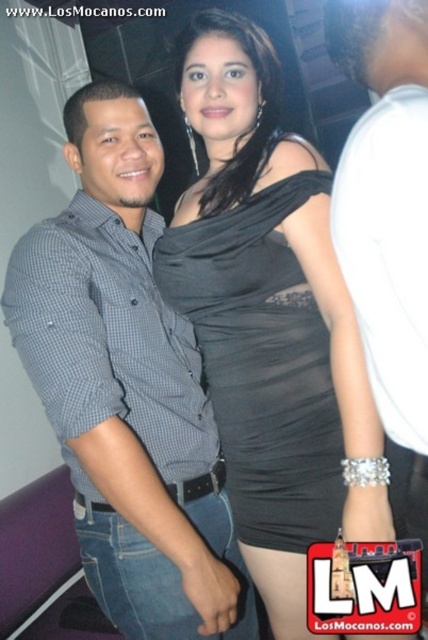
Who is shorter, black satin dress at center or gray checkered shirt at left?

With less height is gray checkered shirt at left.

Is black satin dress at center thinner than gray checkered shirt at left?

Yes, black satin dress at center is thinner than gray checkered shirt at left.

Describe the element at coordinates (270, 320) in the screenshot. I see `black satin dress at center` at that location.

What are the coordinates of `black satin dress at center` in the screenshot? It's located at (270, 320).

Is gray checkered shirt at left wider than white matte shirt at center?

Yes.

Who is taller, gray checkered shirt at left or white matte shirt at center?

Standing taller between the two is gray checkered shirt at left.

Is point (11, 296) positioned after point (392, 216)?

Yes, it is behind point (392, 216).

This screenshot has height=640, width=428. Identify the location of gray checkered shirt at left. (127, 388).

Can you confirm if black satin dress at center is positioned to the left of white matte shirt at center?

Correct, you'll find black satin dress at center to the left of white matte shirt at center.

Which of these two, black satin dress at center or white matte shirt at center, stands shorter?

Standing shorter between the two is white matte shirt at center.

Describe the element at coordinates (270, 320) in the screenshot. The width and height of the screenshot is (428, 640). I see `black satin dress at center` at that location.

This screenshot has width=428, height=640. In order to click on black satin dress at center in this screenshot , I will do `click(270, 320)`.